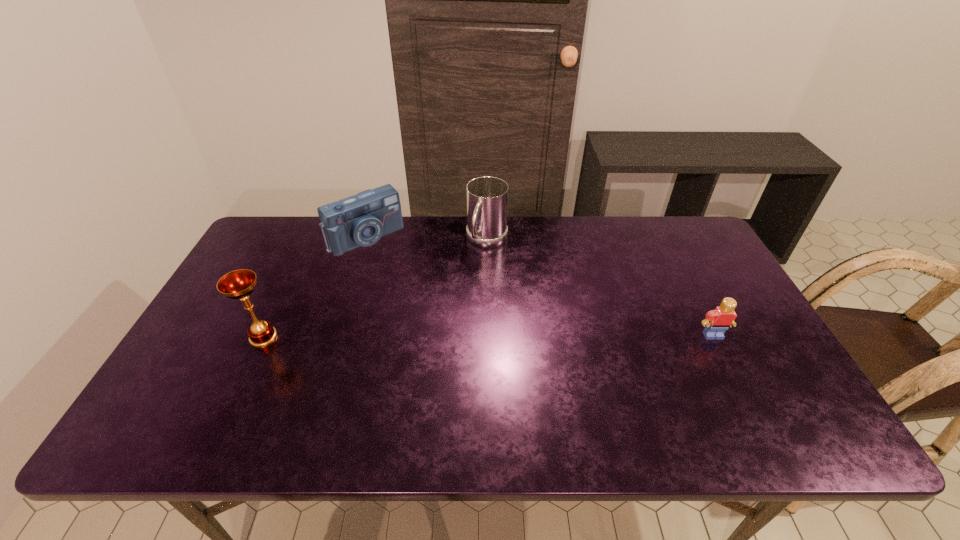
Locate an element on the screen. the leftmost object is located at coordinates coord(239,284).

The image size is (960, 540). Find the location of `Lego`. Lego is located at coordinates (717, 321).

The width and height of the screenshot is (960, 540). In order to click on the shortest object in this screenshot , I will do `click(717, 321)`.

The height and width of the screenshot is (540, 960). I want to click on the second object from left to right, so click(x=360, y=220).

This screenshot has width=960, height=540. In order to click on the second object from right to left in this screenshot , I will do `click(487, 197)`.

Identify the location of blank space located on the right of the chalice. (325, 337).

Where is `free spot located on the front-facing side of the shortest object`? This screenshot has height=540, width=960. free spot located on the front-facing side of the shortest object is located at coordinates (727, 362).

Where is `free space located on the lens of the camera`? This screenshot has height=540, width=960. free space located on the lens of the camera is located at coordinates (429, 303).

At what (x,y) coordinates should I click in order to perform the action: click on free point located 0.100m on the lens of the camera. Please return your answer as a coordinate pair (x, y). Image resolution: width=960 pixels, height=540 pixels. Looking at the image, I should click on (398, 270).

This screenshot has height=540, width=960. Find the location of `vacant space situated on the lens of the camera`. vacant space situated on the lens of the camera is located at coordinates (401, 273).